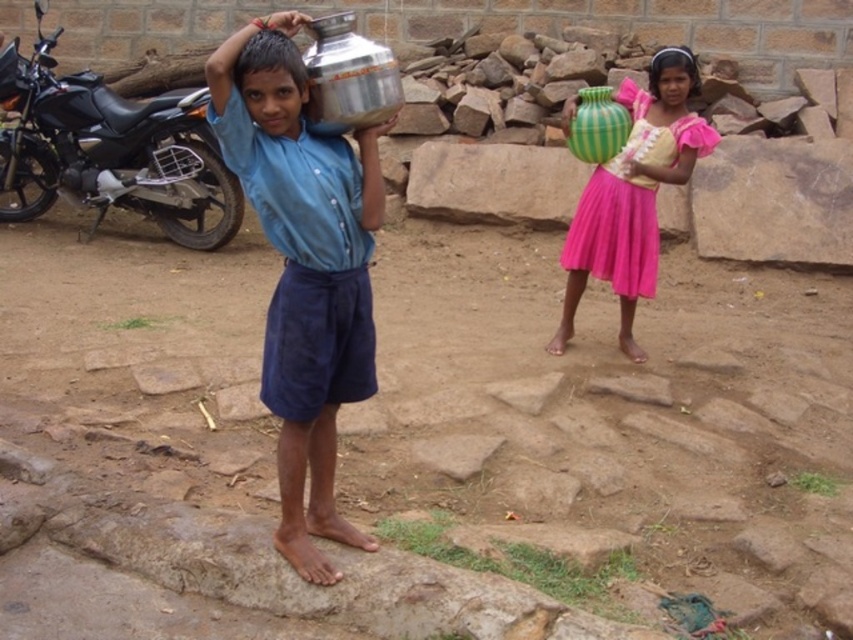
What is located at the coordinate point (109, 148) in the image?

A black metallic motorcycle is located at the coordinate point (109, 148) in the image.

You are a photographer standing at the camera position. You want to take a closeup photo of the shiny metallic pot at center. The camera can focus on objects within 2 meters. Can you take the photo without moving closer?

The shiny metallic pot at center is 2.86 meters from camera. Since the camera can focus within 2 meters, you need to move closer to get a closeup photo.

You are a delivery person who needs to deliver a package to the address located 5 meters away from the black metallic motorcycle at left. The package must be placed exactly at the location of the metallic silver water container at upper center. Can you safely make the delivery without exceeding the 5.30 meters distance limit?

The distance between the black metallic motorcycle at left and the metallic silver water container at upper center is 5.30 meters. Since the required delivery distance is exactly 5 meters, you can safely make the delivery without exceeding the 5.30 meters limit.